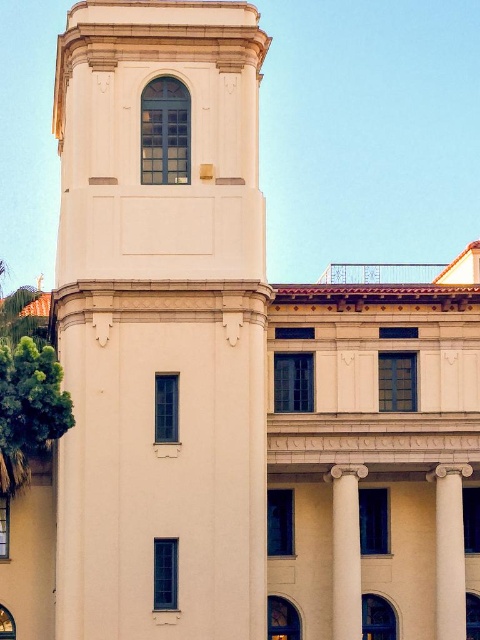
Question: Does white smooth column at right appear on the left side of white marble column at center?

Choices:
 (A) no
 (B) yes

Answer: (A)

Question: Considering the real-world distances, which object is closest to the white marble column at center?

Choices:
 (A) white smooth tower at center
 (B) white smooth column at right

Answer: (B)

Question: Is white smooth column at right thinner than white marble column at center?

Choices:
 (A) yes
 (B) no

Answer: (B)

Question: Can you confirm if white smooth tower at center is positioned to the right of white marble column at center?

Choices:
 (A) yes
 (B) no

Answer: (B)

Question: Which is nearer to the white marble column at center?

Choices:
 (A) white smooth tower at center
 (B) white smooth column at right

Answer: (B)

Question: Which object is farther from the camera taking this photo?

Choices:
 (A) white marble column at center
 (B) white smooth column at right

Answer: (B)